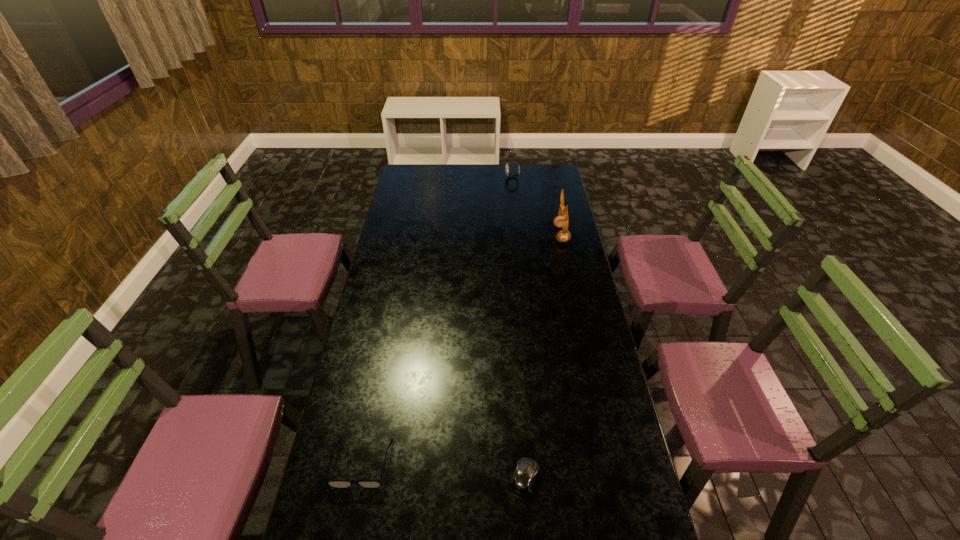
This screenshot has width=960, height=540. I want to click on vacant area that lies between the third nearest object and the mouse, so click(x=543, y=356).

Find the location of a particular element. the closest object relative to the leftmost object is located at coordinates (523, 480).

Locate which object is the closest to the spectacles. Please provide its 2D coordinates. Your answer should be formatted as a tuple, i.e. [(x, y)], where the tuple contains the x and y coordinates of a point satisfying the conditions above.

[(523, 480)]

Where is `vacant point that satisfies the following two spatial constraints: 1. on the front-facing side of the mouse; 2. on the right side of the leftmost object`? The image size is (960, 540). vacant point that satisfies the following two spatial constraints: 1. on the front-facing side of the mouse; 2. on the right side of the leftmost object is located at coordinates (359, 477).

Identify the location of vacant area that satisfies the following two spatial constraints: 1. on the front-facing side of the mouse; 2. on the right side of the leftmost object. This screenshot has width=960, height=540. (359, 477).

The width and height of the screenshot is (960, 540). I want to click on vacant space that satisfies the following two spatial constraints: 1. on the face of the watch; 2. on the front side of the mouse, so click(543, 477).

What are the coordinates of `free location that satisfies the following two spatial constraints: 1. on the front-facing side of the earphone; 2. on the front-facing side of the spectacles` in the screenshot? It's located at (612, 463).

The width and height of the screenshot is (960, 540). Identify the location of free location that satisfies the following two spatial constraints: 1. on the front-facing side of the earphone; 2. on the front-facing side of the leftmost object. (612, 463).

Where is `free space that satisfies the following two spatial constraints: 1. on the front-facing side of the rightmost object; 2. on the front-facing side of the leftmost object`? The height and width of the screenshot is (540, 960). free space that satisfies the following two spatial constraints: 1. on the front-facing side of the rightmost object; 2. on the front-facing side of the leftmost object is located at coordinates (612, 463).